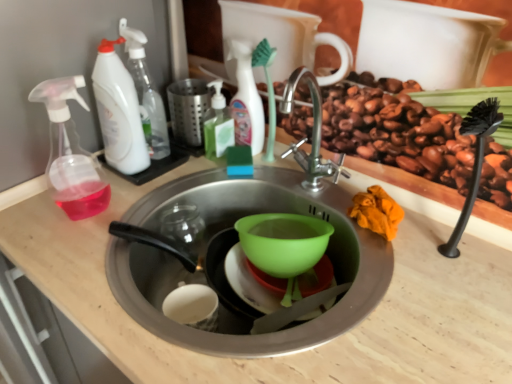
Image resolution: width=512 pixels, height=384 pixels. I want to click on vacant point to the right of white plastic spray bottle at upper left, the 1th cleaning product viewed from the left, so click(x=186, y=164).